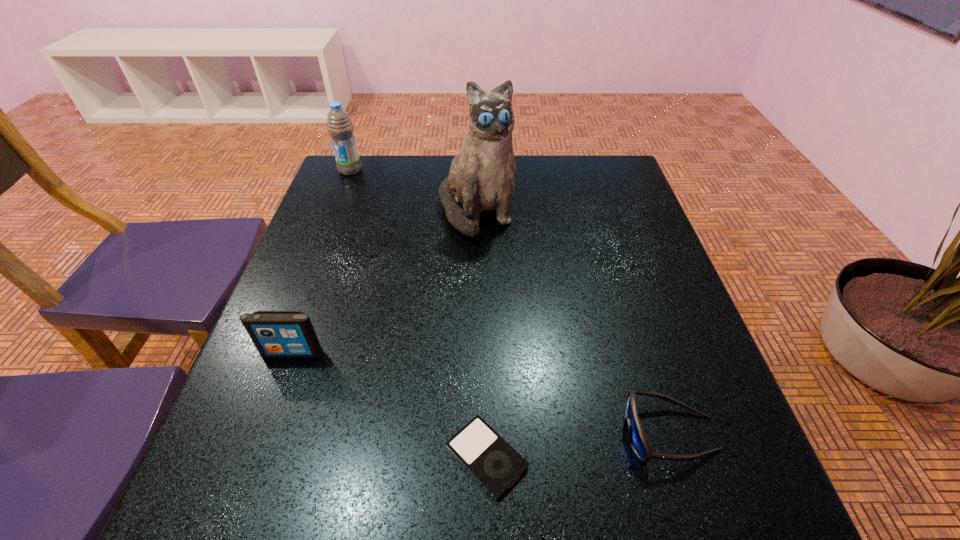
The height and width of the screenshot is (540, 960). Find the location of `the fourth nearest object`. the fourth nearest object is located at coordinates (481, 178).

The width and height of the screenshot is (960, 540). Find the location of `cat`. cat is located at coordinates (481, 178).

Identify the location of water bottle. (339, 125).

Find the location of a particular element. the farthest object is located at coordinates (339, 125).

This screenshot has height=540, width=960. I want to click on the farther iPod, so click(x=276, y=334).

The height and width of the screenshot is (540, 960). In order to click on the third shortest object in this screenshot , I will do `click(276, 334)`.

The image size is (960, 540). Find the location of `the second shortest object`. the second shortest object is located at coordinates (638, 440).

Locate an element on the screen. The image size is (960, 540). the rightmost object is located at coordinates (638, 440).

You are a GUI agent. You are given a task and a screenshot of the screen. Output one action in this format:
    pyautogui.click(x=<x>, y=<y>)
    Task: Click on the right iPod
    Image resolution: width=960 pixels, height=540 pixels.
    Given the screenshot: What is the action you would take?
    pyautogui.click(x=489, y=458)

The width and height of the screenshot is (960, 540). I want to click on the shorter iPod, so pos(489,458).